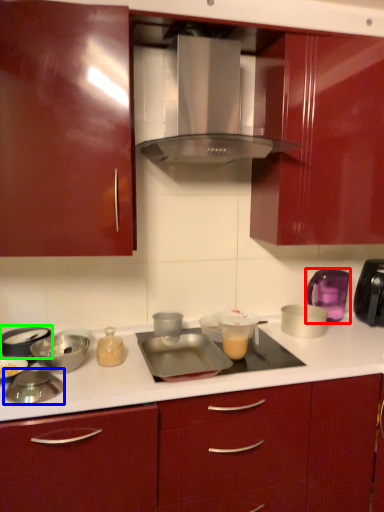
Question: Which is farther away from kitchen appliance (highlighted by a red box)? appliance (highlighted by a blue box) or appliance (highlighted by a green box)?

Choices:
 (A) appliance
 (B) appliance

Answer: (A)